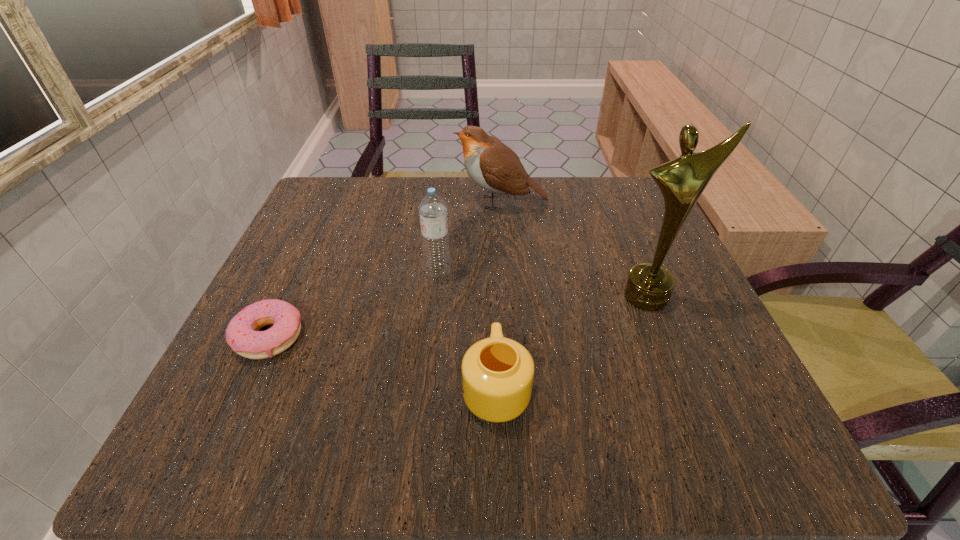
At what (x,y) coordinates should I click in order to perform the action: click on award. Please return your answer as a coordinate pair (x, y). Image resolution: width=960 pixels, height=540 pixels. Looking at the image, I should click on (649, 287).

Where is `the rightmost object`? the rightmost object is located at coordinates (649, 287).

In order to click on the farthest object in this screenshot , I will do `click(492, 165)`.

Find the location of a particular element. This screenshot has width=960, height=540. the second farthest object is located at coordinates (432, 208).

Where is `the second shortest object`? This screenshot has height=540, width=960. the second shortest object is located at coordinates (497, 372).

I want to click on the leftmost object, so click(242, 334).

The image size is (960, 540). What are the coordinates of `doughnut` in the screenshot? It's located at click(x=242, y=334).

You are a GUI agent. You are given a task and a screenshot of the screen. Output one action in this format:
    pyautogui.click(x=<x>, y=<y>)
    Task: Click on the free space located on the front-facing side of the tallest object
    The width and height of the screenshot is (960, 540).
    Given the screenshot: What is the action you would take?
    pyautogui.click(x=700, y=427)

The height and width of the screenshot is (540, 960). I want to click on free region located 0.260m at the face of the bird, so click(340, 202).

The image size is (960, 540). Identify the location of free space located at the face of the bird. (371, 202).